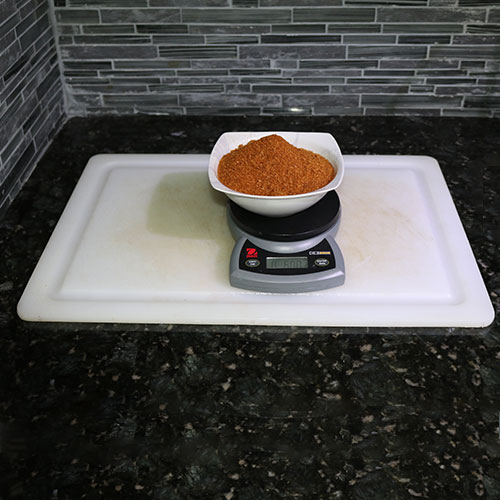
This screenshot has width=500, height=500. What are the coordinates of `white cutting board` in the screenshot? It's located at (404, 282).